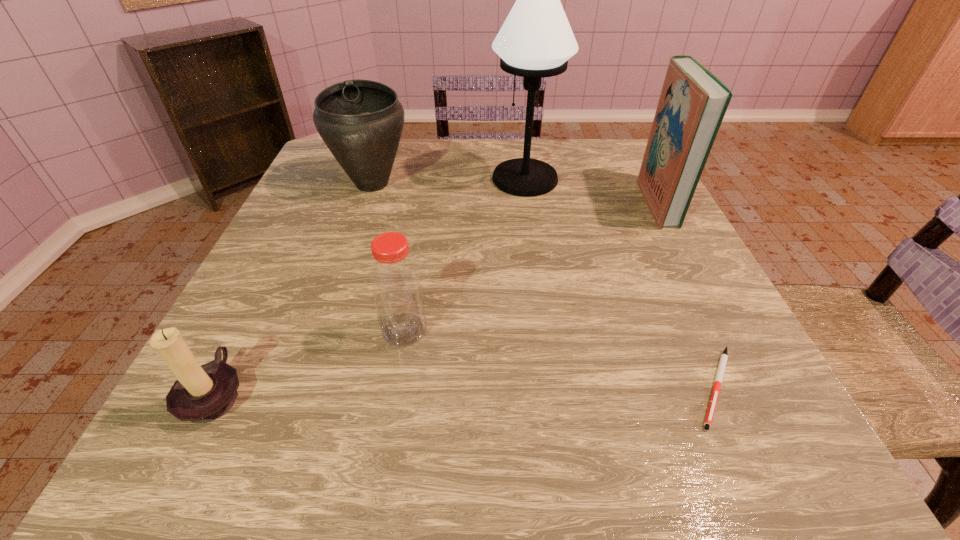
Locate an element on the screen. Image resolution: width=960 pixels, height=540 pixels. table lamp is located at coordinates (536, 40).

The width and height of the screenshot is (960, 540). What are the coordinates of `the fourth object from left to right` in the screenshot? It's located at (536, 40).

Find the location of `hardback book`. hardback book is located at coordinates (693, 102).

Where is `urn`? urn is located at coordinates (361, 121).

Where is `bottle`? Image resolution: width=960 pixels, height=540 pixels. bottle is located at coordinates (396, 285).

Locate an element on the screen. This screenshot has width=960, height=540. candle holder is located at coordinates (201, 394).

Find the location of `the shortest object`. the shortest object is located at coordinates (723, 360).

The width and height of the screenshot is (960, 540). What are the coordinates of `vacant position located on the front of the table lamp` in the screenshot? It's located at (535, 246).

This screenshot has height=540, width=960. Find the location of `free space located on the cover of the fifth shortest object`. free space located on the cover of the fifth shortest object is located at coordinates (598, 202).

You are a GUI agent. You are given a task and a screenshot of the screen. Output one action in this format:
    pyautogui.click(x=<x>, y=<y>)
    Task: Click on the vacant position located on the cover of the fifth shortest object
    This screenshot has width=960, height=540.
    Given the screenshot: What is the action you would take?
    pyautogui.click(x=492, y=202)